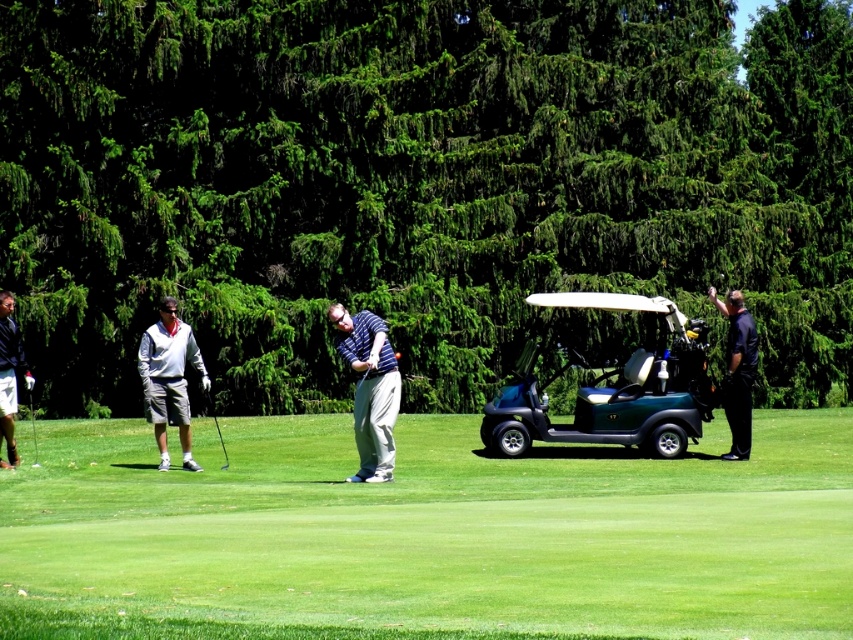
Is white sweater at center further to camera compared to black smooth golf club at right?

No.

Who is lower down, white sweater at center or black smooth golf club at right?

white sweater at center is lower down.

Is point (157, 392) farther from viewer compared to point (746, 444)?

That is False.

The image size is (853, 640). In order to click on white sweater at center in this screenshot , I will do `click(169, 380)`.

Between green matte golf cart at center and white cotton shirt at left, which one is positioned higher?

green matte golf cart at center is higher up.

Is green matte golf cart at center positioned before white cotton shirt at left?

No, it is behind white cotton shirt at left.

Between point (498, 397) and point (13, 326), which one is positioned in front?

Point (13, 326) is in front.

The image size is (853, 640). I want to click on green matte golf cart at center, so click(611, 388).

Does white sweater at center have a lesser width compared to metallic silver golf club at lower left?

Yes.

Is white sweater at center further to the viewer compared to metallic silver golf club at lower left?

Yes, it is behind metallic silver golf club at lower left.

At what (x,y) coordinates should I click in order to perform the action: click on white sweater at center. Please return your answer as a coordinate pair (x, y). Looking at the image, I should click on (169, 380).